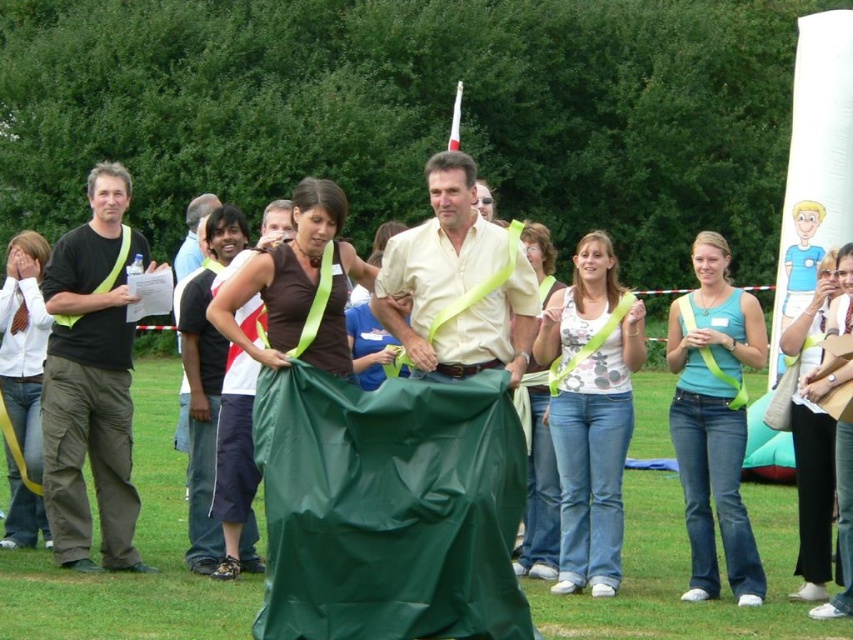
Question: Does matte black shirt at left have a larger size compared to matte black t-shirt at left?

Choices:
 (A) no
 (B) yes

Answer: (B)

Question: Which of the following is the closest to the observer?

Choices:
 (A) click(x=184, y=282)
 (B) click(x=468, y=230)
 (C) click(x=74, y=570)

Answer: (B)

Question: Among these objects, which one is farthest from the camera?

Choices:
 (A) matte yellow shirt at center
 (B) matte black t-shirt at left

Answer: (B)

Question: Observing the image, what is the correct spatial positioning of matte yellow shirt at center in reference to matte black t-shirt at left?

Choices:
 (A) left
 (B) right

Answer: (B)

Question: Can you confirm if matte black shirt at left is wider than matte black t-shirt at left?

Choices:
 (A) yes
 (B) no

Answer: (A)

Question: Among these points, which one is farthest from the camera?

Choices:
 (A) (184, 436)
 (B) (485, 332)
 (C) (74, 346)

Answer: (A)